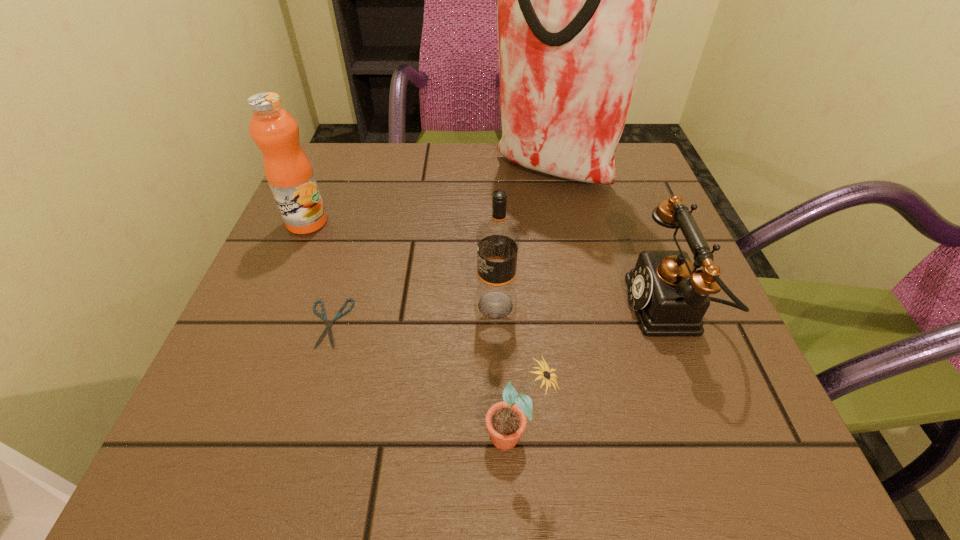
At what (x,y) coordinates should I click in order to perform the action: click on free space located 0.170m on the back of the shears. Please return your answer as a coordinate pair (x, y). Looking at the image, I should click on (355, 235).

Image resolution: width=960 pixels, height=540 pixels. Find the location of `object located at the far edge`. object located at the far edge is located at coordinates (575, 0).

Where is `object located at the near edge`? The image size is (960, 540). object located at the near edge is located at coordinates (506, 421).

Identify the location of fruit juice situated at the left edge. This screenshot has width=960, height=540. (289, 173).

This screenshot has height=540, width=960. What are the coordinates of `shears that is at the left edge` in the screenshot? It's located at (x=328, y=325).

The image size is (960, 540). Find the location of `grocery bag situated at the right edge`. grocery bag situated at the right edge is located at coordinates (575, 0).

Image resolution: width=960 pixels, height=540 pixels. What are the coordinates of `telephone positioned at the right edge` in the screenshot? It's located at (670, 298).

Identify the location of object that is at the far right corner. The image size is (960, 540). (575, 0).

Identify the location of free space at the far edge of the desktop. The height and width of the screenshot is (540, 960). (430, 157).

Locate an element on the screen. vacant point at the near edge is located at coordinates (468, 427).